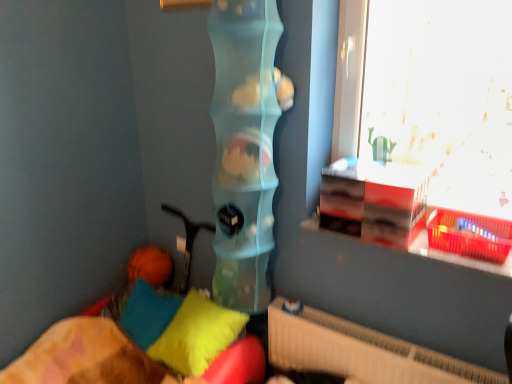
What do you see at coordinates (130, 343) in the screenshot?
I see `soft fabric pillows at lower left` at bounding box center [130, 343].

The image size is (512, 384). What do you see at coordinates (148, 313) in the screenshot?
I see `soft cotton pillow at lower left, the 2th pillow in the right-to-left sequence` at bounding box center [148, 313].

Locate an element on the screen. The width and height of the screenshot is (512, 384). soft fabric pillows at lower left is located at coordinates (130, 343).

Looking at this image, from a real-world perspective, between soft plush pillow at lower left, which is counted as the 1th pillow, starting from the right, and soft cotton pillow at lower left, the 2th pillow in the right-to-left sequence, who is vertically higher?

soft plush pillow at lower left, which is counted as the 1th pillow, starting from the right.

Between soft plush pillow at lower left, which is counted as the 1th pillow, starting from the right, and soft cotton pillow at lower left, which is the first pillow in left-to-right order, which one has more height?

soft plush pillow at lower left, which is counted as the 1th pillow, starting from the right.

Is soft plush pillow at lower left, arranged as the 2th pillow when viewed from the left, smaller than soft cotton pillow at lower left, which is the first pillow in left-to-right order?

Actually, soft plush pillow at lower left, arranged as the 2th pillow when viewed from the left, might be larger than soft cotton pillow at lower left, which is the first pillow in left-to-right order.

From the picture: From the image's perspective, which is above, soft plush pillow at lower left, arranged as the 2th pillow when viewed from the left, or soft cotton pillow at lower left, the 2th pillow in the right-to-left sequence?

From the image's view, soft cotton pillow at lower left, the 2th pillow in the right-to-left sequence, is above.

From the picture: Considering the relative sizes of soft plush pillow at lower left, arranged as the 2th pillow when viewed from the left, and white textured radiator at lower right in the image provided, is soft plush pillow at lower left, arranged as the 2th pillow when viewed from the left, shorter than white textured radiator at lower right?

Indeed, soft plush pillow at lower left, arranged as the 2th pillow when viewed from the left, has a lesser height compared to white textured radiator at lower right.

Which point is more forward, (189, 367) or (431, 380)?

The point (431, 380) is more forward.

Image resolution: width=512 pixels, height=384 pixels. I want to click on radiator lying below the soft plush pillow at lower left, which is counted as the 1th pillow, starting from the right (from the image's perspective), so click(360, 352).

Do you think soft cotton pillow at lower left, the 2th pillow in the right-to-left sequence, is within soft plush pillow at lower left, arranged as the 2th pillow when viewed from the left, or outside of it?

soft cotton pillow at lower left, the 2th pillow in the right-to-left sequence, is outside soft plush pillow at lower left, arranged as the 2th pillow when viewed from the left.

In the scene shown: Considering the relative sizes of soft cotton pillow at lower left, the 2th pillow in the right-to-left sequence, and soft plush pillow at lower left, arranged as the 2th pillow when viewed from the left, in the image provided, is soft cotton pillow at lower left, the 2th pillow in the right-to-left sequence, thinner than soft plush pillow at lower left, arranged as the 2th pillow when viewed from the left,?

Correct, the width of soft cotton pillow at lower left, the 2th pillow in the right-to-left sequence, is less than that of soft plush pillow at lower left, arranged as the 2th pillow when viewed from the left.

Could you tell me if soft cotton pillow at lower left, which is the first pillow in left-to-right order, is turned towards soft plush pillow at lower left, arranged as the 2th pillow when viewed from the left?

No, soft cotton pillow at lower left, which is the first pillow in left-to-right order, is not oriented towards soft plush pillow at lower left, arranged as the 2th pillow when viewed from the left.

From the image's perspective, which is above, soft cotton pillow at lower left, which is the first pillow in left-to-right order, or soft plush pillow at lower left, which is counted as the 1th pillow, starting from the right?

soft cotton pillow at lower left, which is the first pillow in left-to-right order.

Can you see soft fabric pillows at lower left touching white textured radiator at lower right?

No, soft fabric pillows at lower left is not in contact with white textured radiator at lower right.

Does soft fabric pillows at lower left turn towards white textured radiator at lower right?

No, soft fabric pillows at lower left is not facing towards white textured radiator at lower right.

Find the location of a particular element. The width and height of the screenshot is (512, 384). furniture below the white textured radiator at lower right (from the image's perspective) is located at coordinates (130, 343).

How distant is soft fabric pillows at lower left from white textured radiator at lower right?

They are 21.27 inches apart.

Looking at this image, is translucent plastic toy at center facing towards soft plush pillow at lower left, which is counted as the 1th pillow, starting from the right?

Yes, translucent plastic toy at center is oriented towards soft plush pillow at lower left, which is counted as the 1th pillow, starting from the right.

Looking at their sizes, would you say translucent plastic toy at center is wider or thinner than soft plush pillow at lower left, which is counted as the 1th pillow, starting from the right?

translucent plastic toy at center is thinner than soft plush pillow at lower left, which is counted as the 1th pillow, starting from the right.

From a real-world perspective, is translucent plastic toy at center beneath soft plush pillow at lower left, which is counted as the 1th pillow, starting from the right?

No, from a real-world perspective, translucent plastic toy at center is not beneath soft plush pillow at lower left, which is counted as the 1th pillow, starting from the right.

How much distance is there between translucent plastic toy at center and soft plush pillow at lower left, arranged as the 2th pillow when viewed from the left?

translucent plastic toy at center and soft plush pillow at lower left, arranged as the 2th pillow when viewed from the left, are 15.08 inches apart from each other.

Considering their positions, is white textured radiator at lower right located in front of or behind soft plush pillow at lower left, arranged as the 2th pillow when viewed from the left?

In the image, white textured radiator at lower right appears in front of soft plush pillow at lower left, arranged as the 2th pillow when viewed from the left.

Is white textured radiator at lower right spatially inside soft plush pillow at lower left, which is counted as the 1th pillow, starting from the right, or outside of it?

The correct answer is: outside.

From a real-world perspective, is white textured radiator at lower right physically above soft plush pillow at lower left, arranged as the 2th pillow when viewed from the left?

No, from a real-world perspective, white textured radiator at lower right is not on top of soft plush pillow at lower left, arranged as the 2th pillow when viewed from the left.

Which is nearer, (380, 345) or (161, 350)?

Clearly, point (380, 345) is closer to the camera than point (161, 350).

Does point (191, 360) come closer to viewer compared to point (443, 84)?

Yes, point (191, 360) is closer to viewer.

Does soft plush pillow at lower left, which is counted as the 1th pillow, starting from the right, have a lesser width compared to transparent glass window at upper right?

No.

From a real-world perspective, is soft plush pillow at lower left, which is counted as the 1th pillow, starting from the right, positioned above or below transparent glass window at upper right?

From a real-world perspective, soft plush pillow at lower left, which is counted as the 1th pillow, starting from the right, is physically below transparent glass window at upper right.

Considering the sizes of soft plush pillow at lower left, which is counted as the 1th pillow, starting from the right, and transparent glass window at upper right in the image, is soft plush pillow at lower left, which is counted as the 1th pillow, starting from the right, taller or shorter than transparent glass window at upper right?

Clearly, soft plush pillow at lower left, which is counted as the 1th pillow, starting from the right, is shorter compared to transparent glass window at upper right.

Image resolution: width=512 pixels, height=384 pixels. In the image, there is a soft plush pillow at lower left, which is counted as the 1th pillow, starting from the right. What are the coordinates of `pillow above it (from the image's perspective)` in the screenshot? It's located at (148, 313).

You are a GUI agent. You are given a task and a screenshot of the screen. Output one action in this format:
    pyautogui.click(x=<x>, y=<y>)
    Task: Click on the radiator on the right of soft plush pillow at lower left, arranged as the 2th pillow when viewed from the left
    Image resolution: width=512 pixels, height=384 pixels.
    Given the screenshot: What is the action you would take?
    pyautogui.click(x=360, y=352)

From the picture: Looking at the image, which one is located closer to soft cotton pillow at lower left, the 2th pillow in the right-to-left sequence, white textured radiator at lower right or translucent plastic toy at center?

translucent plastic toy at center lies closer to soft cotton pillow at lower left, the 2th pillow in the right-to-left sequence, than the other object.

Based on the photo, from the image, which object appears to be farther from soft plush pillow at lower left, which is counted as the 1th pillow, starting from the right, soft fabric pillows at lower left or translucent plastic toy at center?

The object further to soft plush pillow at lower left, which is counted as the 1th pillow, starting from the right, is translucent plastic toy at center.

When comparing their distances from transparent glass window at upper right, does white textured radiator at lower right or soft plush pillow at lower left, arranged as the 2th pillow when viewed from the left, seem closer?

white textured radiator at lower right lies closer to transparent glass window at upper right than the other object.

Looking at the image, which one is located closer to soft fabric pillows at lower left, white textured radiator at lower right or transparent glass window at upper right?

The object closer to soft fabric pillows at lower left is white textured radiator at lower right.

When comparing their distances from translucent plastic toy at center, does soft cotton pillow at lower left, the 2th pillow in the right-to-left sequence, or white textured radiator at lower right seem further?

soft cotton pillow at lower left, the 2th pillow in the right-to-left sequence, is positioned further to the anchor translucent plastic toy at center.

Looking at the image, which one is located closer to soft fabric pillows at lower left, soft plush pillow at lower left, arranged as the 2th pillow when viewed from the left, or translucent plastic toy at center?

The object closer to soft fabric pillows at lower left is soft plush pillow at lower left, arranged as the 2th pillow when viewed from the left.

Looking at the image, which one is located further to translucent plastic toy at center, transparent glass window at upper right or soft cotton pillow at lower left, which is the first pillow in left-to-right order?

Based on the image, transparent glass window at upper right appears to be further to translucent plastic toy at center.

Based on the photo, which object lies further to the anchor point white textured radiator at lower right, soft fabric pillows at lower left or soft plush pillow at lower left, arranged as the 2th pillow when viewed from the left?

soft fabric pillows at lower left lies further to white textured radiator at lower right than the other object.

Where is `pillow between translucent plastic toy at center and soft plush pillow at lower left, arranged as the 2th pillow when viewed from the left, vertically`? The image size is (512, 384). pillow between translucent plastic toy at center and soft plush pillow at lower left, arranged as the 2th pillow when viewed from the left, vertically is located at coordinates (148, 313).

What are the coordinates of `radiator between soft fabric pillows at lower left and transparent glass window at upper right from left to right` in the screenshot? It's located at (360, 352).

Locate an element on the screen. toy that lies between transparent glass window at upper right and white textured radiator at lower right from top to bottom is located at coordinates (245, 147).

At what (x,y) coordinates should I click in order to perform the action: click on pillow between soft cotton pillow at lower left, which is the first pillow in left-to-right order, and transparent glass window at upper right, in the horizontal direction. Please return your answer as a coordinate pair (x, y). The width and height of the screenshot is (512, 384). Looking at the image, I should click on (197, 334).